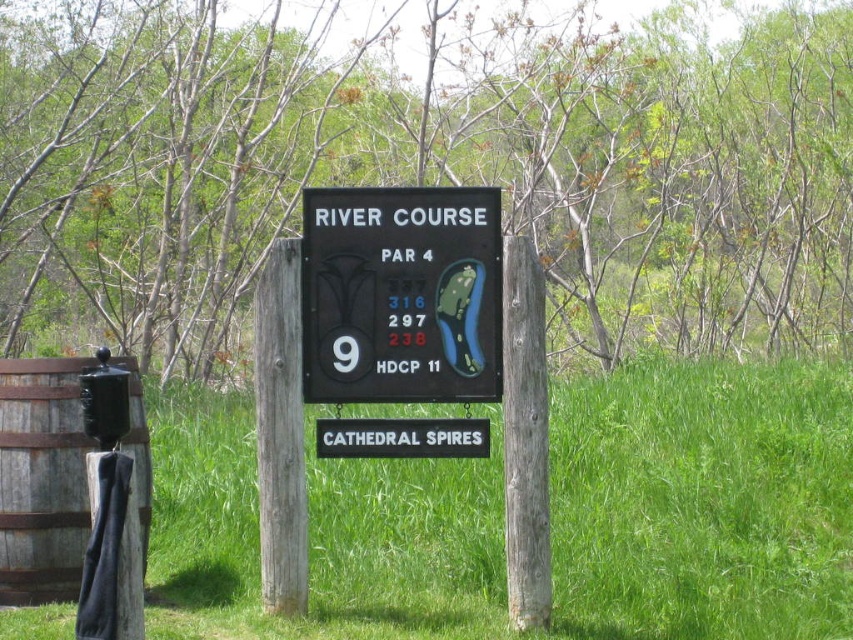
Question: Which of the following is the closest to the observer?

Choices:
 (A) (0, 388)
 (B) (508, 390)
 (C) (364, 432)

Answer: (B)

Question: Which point is closer to the camera taking this photo?

Choices:
 (A) (283, 522)
 (B) (28, 476)
 (C) (544, 458)

Answer: (C)

Question: Is brown rough wood post at center above white plastic sign at center?

Choices:
 (A) no
 (B) yes

Answer: (B)

Question: Considering the real-world distances, which object is closest to the brown wooden barrel at left?

Choices:
 (A) black plastic sign at center
 (B) white plastic sign at center

Answer: (B)

Question: Is green grass at center bigger than black plastic sign at center?

Choices:
 (A) no
 (B) yes

Answer: (B)

Question: Does brown rough wood post at center appear on the right side of white plastic sign at center?

Choices:
 (A) yes
 (B) no

Answer: (A)